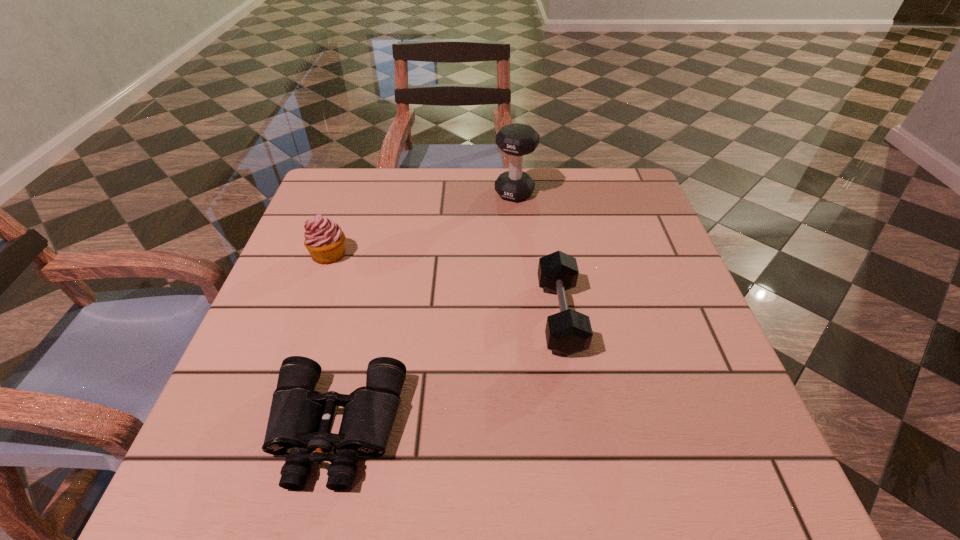
At what (x,y) coordinates should I click in order to perform the action: click on empty space between the third nearest object and the binoculars. Please return your answer as a coordinate pair (x, y). This screenshot has height=540, width=960. Looking at the image, I should click on (333, 341).

Where is `vacant space that is in between the shortest object and the third shortest object`? The height and width of the screenshot is (540, 960). vacant space that is in between the shortest object and the third shortest object is located at coordinates click(333, 341).

Identify the location of vacant point located between the cupcake and the third farthest object. The image size is (960, 540). (444, 285).

Where is `the second closest object to the farther dumbbell`? This screenshot has width=960, height=540. the second closest object to the farther dumbbell is located at coordinates [324, 239].

Locate which object is the closest to the second tallest object. Please provide its 2D coordinates. Your answer should be formatted as a tuple, i.e. [(x, y)], where the tuple contains the x and y coordinates of a point satisfying the conditions above.

[(300, 418)]

The width and height of the screenshot is (960, 540). Find the location of `free space that satisfies the following two spatial constraints: 1. on the front side of the nearer dumbbell; 2. on the right side of the third shortest object`. free space that satisfies the following two spatial constraints: 1. on the front side of the nearer dumbbell; 2. on the right side of the third shortest object is located at coordinates (307, 315).